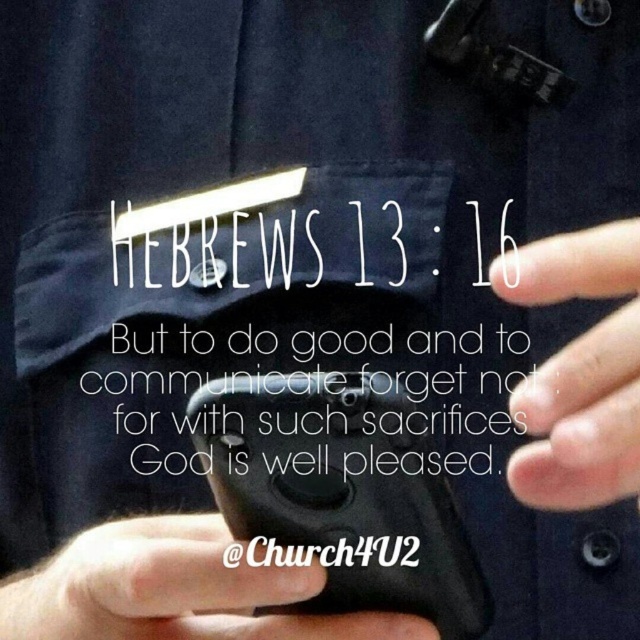
The scene shows a person holding a black matte phone at lower center and a white matte finger at center. Which object is bigger?

The black matte phone at lower center is larger in size compared to the white matte finger at center.